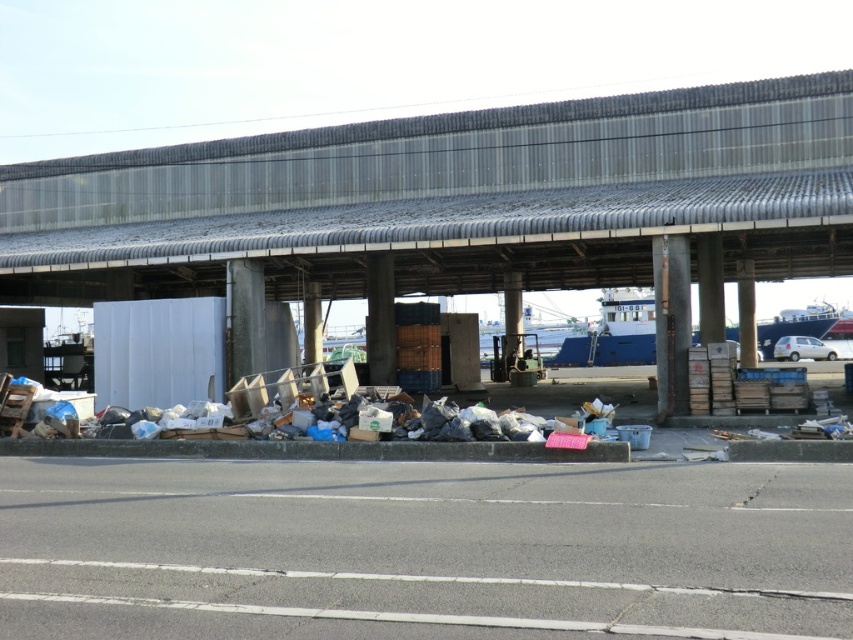
You are a delivery person standing at point A, which is at coordinates point (68, 256). You need to deliver a package to point B, located at coordinates point (792, 340). However, there are obstacles between the two points. Based on the scene description, can you determine if your path from point A to point B is blocked by the overpass structure?

Point (68, 256) is in front of point (792, 340), meaning the path from point A to point B is not blocked by the overpass structure since point A is closer to the viewer and point B is further back under the overpass.

You are standing at the origin point of the coordinate system where the cluttered area is at the bottom. Which direction should you move to reach the metallic gray overpass at upper center located at point (450, 198)?

The metallic gray overpass at upper center is located at point (450, 198), so you should move upward and slightly to the right from the cluttered area at the bottom to reach it.

You are a delivery driver who needs to pass under the metallic gray overpass at upper center with your white glossy car at right. The car is 2 meters wide. Can you safely drive under the overpass without hitting the sides?

The metallic gray overpass at upper center is wider than the white glossy car at right. Since the car is 2 meters wide and the overpass is wider, there should be enough space on both sides for the car to pass safely without hitting the sides.